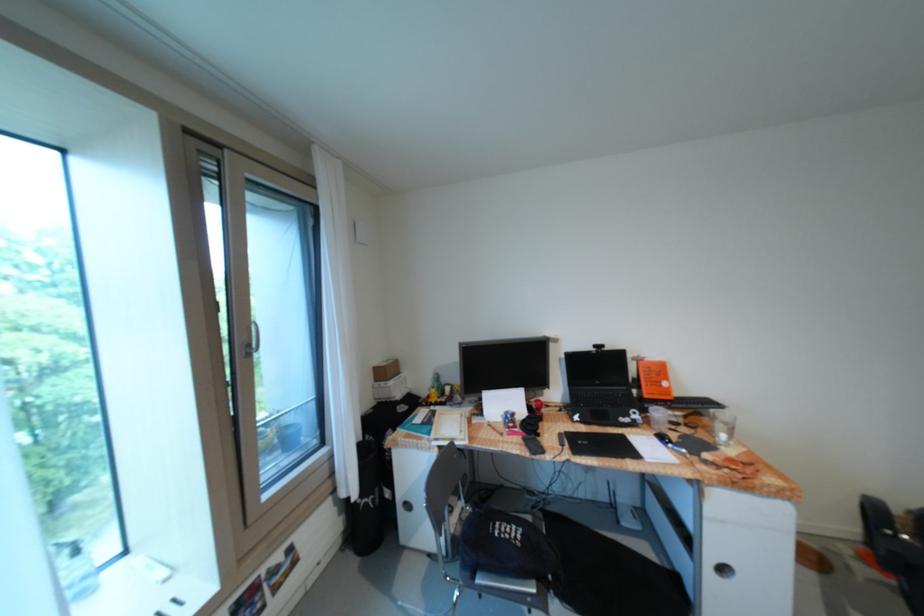
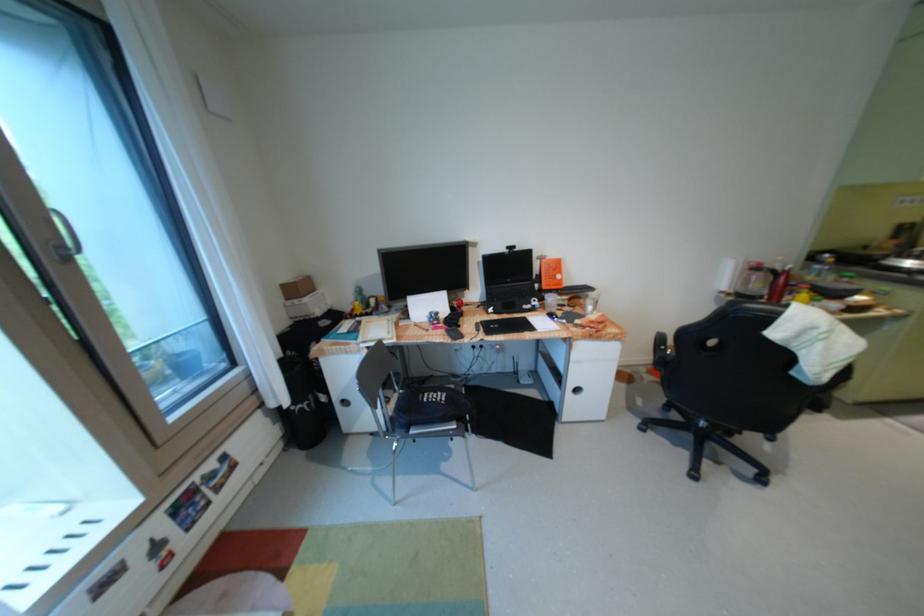
In the second image, find the point that corresponds to (518,525) in the first image.

(445, 392)